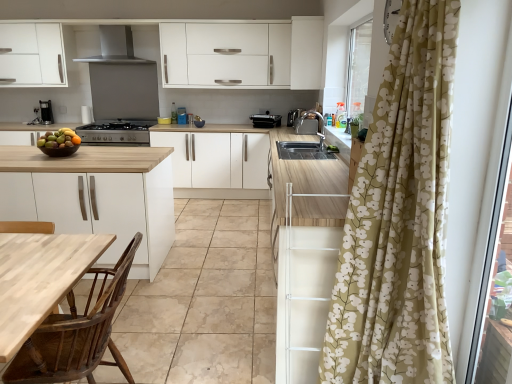
Image resolution: width=512 pixels, height=384 pixels. I want to click on white matte cabinet at center, which appears as the 2th cabinetry when viewed from the right, so click(x=217, y=159).

Image resolution: width=512 pixels, height=384 pixels. What do you see at coordinates (217, 159) in the screenshot? I see `white matte cabinet at center, which appears as the 2th cabinetry when viewed from the right` at bounding box center [217, 159].

What are the coordinates of `wooden at left` in the screenshot? It's located at (199, 301).

How much space does satin silver toaster at upper center, which is the second appliance from left to right, occupy vertically?

satin silver toaster at upper center, which is the second appliance from left to right, is 22.51 centimeters tall.

Describe the element at coordinates (294, 116) in the screenshot. I see `satin silver toaster at upper center, which is the second appliance from left to right` at that location.

Image resolution: width=512 pixels, height=384 pixels. In order to click on transparent glass screen door at right in this screenshot , I will do `click(490, 250)`.

This screenshot has height=384, width=512. Describe the element at coordinates (265, 120) in the screenshot. I see `black plastic toaster at center, which is counted as the second appliance, starting from the right` at that location.

Find the location of a particular element. black plastic toaster at center, which appears as the 1th appliance when viewed from the left is located at coordinates (265, 120).

Describe the element at coordinates (115, 47) in the screenshot. I see `stainless steel exhaust hood at upper center` at that location.

I want to click on white matte cabinet at center, the second cabinetry positioned from the top, so click(217, 159).

Does white matte cabinet at upper center, which appears as the 1th cabinetry when viewed from the top, come in front of stainless steel exhaust hood at upper center?

That is True.

Who is shorter, white matte cabinet at upper center, the second cabinetry from the left, or stainless steel exhaust hood at upper center?

stainless steel exhaust hood at upper center.

Is white matte cabinet at upper center, the 1th cabinetry viewed from the right, oriented away from stainless steel exhaust hood at upper center?

white matte cabinet at upper center, the 1th cabinetry viewed from the right, is not turned away from stainless steel exhaust hood at upper center.

Which object is positioned more to the right, white matte cabinet at upper center, which ranks as the 2th cabinetry in bottom-to-top order, or stainless steel exhaust hood at upper center?

Positioned to the right is white matte cabinet at upper center, which ranks as the 2th cabinetry in bottom-to-top order.

Which object is thinner, black plastic toaster at center, which is counted as the second appliance, starting from the right, or satin black stove at center?

With smaller width is black plastic toaster at center, which is counted as the second appliance, starting from the right.

In the image, is black plastic toaster at center, which is counted as the second appliance, starting from the right, on the left side or the right side of satin black stove at center?

black plastic toaster at center, which is counted as the second appliance, starting from the right, is positioned on satin black stove at center's right side.

From a real-world perspective, between black plastic toaster at center, which appears as the 1th appliance when viewed from the left, and satin black stove at center, who is vertically higher?

black plastic toaster at center, which appears as the 1th appliance when viewed from the left, from a real-world perspective.

Is satin silver toaster at upper center, the 1th appliance positioned from the right, surrounding satin black stove at center?

No, satin black stove at center is not inside satin silver toaster at upper center, the 1th appliance positioned from the right.

Who is taller, satin silver toaster at upper center, the 1th appliance positioned from the right, or satin black stove at center?

satin black stove at center is taller.

How many degrees apart are the facing directions of satin silver toaster at upper center, the 1th appliance positioned from the right, and satin black stove at center?

The angle between the facing direction of satin silver toaster at upper center, the 1th appliance positioned from the right, and the facing direction of satin black stove at center is 0.629 degrees.

Considering the positions of points (297, 112) and (96, 138), is point (297, 112) farther from camera compared to point (96, 138)?

Yes.

Is stainless steel exhaust hood at upper center far from shiny brown bowl at left?

stainless steel exhaust hood at upper center is far away from shiny brown bowl at left.

From the image's perspective, is stainless steel exhaust hood at upper center on top of shiny brown bowl at left?

Indeed, from the image's perspective, stainless steel exhaust hood at upper center is shown above shiny brown bowl at left.

Which of these two, stainless steel exhaust hood at upper center or shiny brown bowl at left, is bigger?

With larger size is stainless steel exhaust hood at upper center.

Which is more to the left, stainless steel exhaust hood at upper center or shiny brown bowl at left?

From the viewer's perspective, stainless steel exhaust hood at upper center appears more on the left side.

Would you say stainless steel exhaust hood at upper center contains transparent glass screen door at right?

No, stainless steel exhaust hood at upper center does not contain transparent glass screen door at right.

Is point (114, 60) positioned after point (502, 190)?

Yes.

Is stainless steel exhaust hood at upper center wider than transparent glass screen door at right?

Indeed, stainless steel exhaust hood at upper center has a greater width compared to transparent glass screen door at right.

Does wooden polished chair at lower left appear on the left side of satin silver toaster at upper center, the 1th appliance positioned from the right?

Yes, wooden polished chair at lower left is to the left of satin silver toaster at upper center, the 1th appliance positioned from the right.

Can you tell me how much wooden polished chair at lower left and satin silver toaster at upper center, the 1th appliance positioned from the right, differ in facing direction?

179 degrees.

Is wooden polished chair at lower left positioned with its back to satin silver toaster at upper center, the 1th appliance positioned from the right?

That's not correct — wooden polished chair at lower left is not looking away from satin silver toaster at upper center, the 1th appliance positioned from the right.

Is wooden polished chair at lower left smaller than satin silver toaster at upper center, the 1th appliance positioned from the right?

Actually, wooden polished chair at lower left might be larger than satin silver toaster at upper center, the 1th appliance positioned from the right.

Considering the sizes of black plastic toaster at center, which is counted as the second appliance, starting from the right, and wooden at left in the image, is black plastic toaster at center, which is counted as the second appliance, starting from the right, taller or shorter than wooden at left?

Considering their sizes, black plastic toaster at center, which is counted as the second appliance, starting from the right, has less height than wooden at left.

Is wooden at left completely or partially inside black plastic toaster at center, which is counted as the second appliance, starting from the right?

Definitely not — wooden at left is not inside black plastic toaster at center, which is counted as the second appliance, starting from the right.

Is black plastic toaster at center, which is counted as the second appliance, starting from the right, to the right of wooden at left from the viewer's perspective?

Indeed, black plastic toaster at center, which is counted as the second appliance, starting from the right, is positioned on the right side of wooden at left.

Find the location of a particular element. exhaust hood behind the white matte cabinet at upper center, which ranks as the 2th cabinetry in bottom-to-top order is located at coordinates (115, 47).

Identify the location of kitchen appliance that appears below the black plastic toaster at center, which appears as the 1th appliance when viewed from the left (from a real-world perspective). (116, 132).

From the image, which object appears to be farther from white matte cabinet at upper center, the 1th cabinetry viewed from the right, wooden at left or black plastic toaster at center, which is counted as the second appliance, starting from the right?

wooden at left.

From the image, which object appears to be nearer to shiny brown bowl at left, white matte cabinet at upper center, the 1th cabinetry viewed from the right, or transparent glass screen door at right?

The object closer to shiny brown bowl at left is transparent glass screen door at right.

Considering their positions, is white matte cabinet at center, which appears as the 2th cabinetry when viewed from the right, positioned closer to wooden at left than transparent glass screen door at right?

transparent glass screen door at right is closer to wooden at left.

Looking at this image, looking at the image, which one is located closer to white matte cabinet at upper center, the second cabinetry from the left, satin black stove at center or wooden polished chair at lower left?

satin black stove at center.

From the image, which object appears to be nearer to wooden polished chair at lower left, white matte cabinet at upper center, the second cabinetry from the left, or shiny brown bowl at left?

Based on the image, shiny brown bowl at left appears to be nearer to wooden polished chair at lower left.

Estimate the real-world distances between objects in this image. Which object is closer to white matte cabinet at center, which appears as the 2th cabinetry when viewed from the right, black plastic toaster at center, which is counted as the second appliance, starting from the right, or transparent glass screen door at right?

black plastic toaster at center, which is counted as the second appliance, starting from the right.

Looking at the image, which one is located closer to stainless steel exhaust hood at upper center, shiny brown bowl at left or transparent glass screen door at right?

shiny brown bowl at left is positioned closer to the anchor stainless steel exhaust hood at upper center.

Looking at the image, which one is located closer to stainless steel exhaust hood at upper center, satin silver toaster at upper center, the 1th appliance positioned from the right, or black plastic toaster at center, which appears as the 1th appliance when viewed from the left?

Among the two, black plastic toaster at center, which appears as the 1th appliance when viewed from the left, is located nearer to stainless steel exhaust hood at upper center.

Locate an element on the screen. cabinetry between shiny brown bowl at left and white matte cabinet at upper center, which ranks as the 2th cabinetry in bottom-to-top order is located at coordinates (217, 159).

Find the location of a particular element. appliance between wooden polished chair at lower left and satin silver toaster at upper center, which is the second appliance from left to right, from front to back is located at coordinates (265, 120).

Locate an element on the screen. Image resolution: width=512 pixels, height=384 pixels. chair between transparent glass screen door at right and black plastic toaster at center, which appears as the 1th appliance when viewed from the left, from front to back is located at coordinates (76, 334).

Identify the location of exhaust hood between wooden polished chair at lower left and black plastic toaster at center, which is counted as the second appliance, starting from the right, from front to back. Image resolution: width=512 pixels, height=384 pixels. (115, 47).